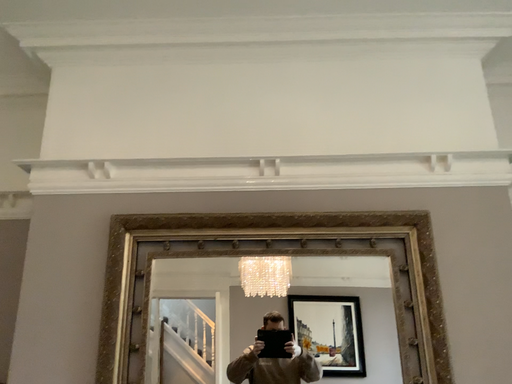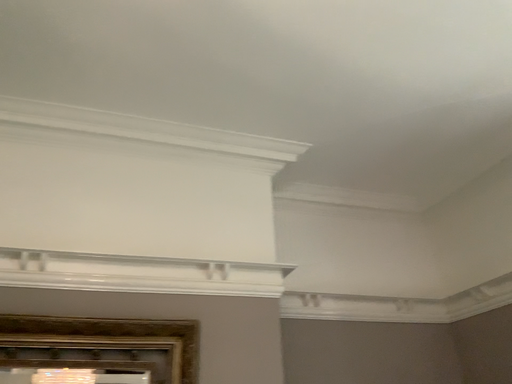
Question: How did the camera likely rotate when shooting the video?

Choices:
 (A) rotated left
 (B) rotated right

Answer: (B)